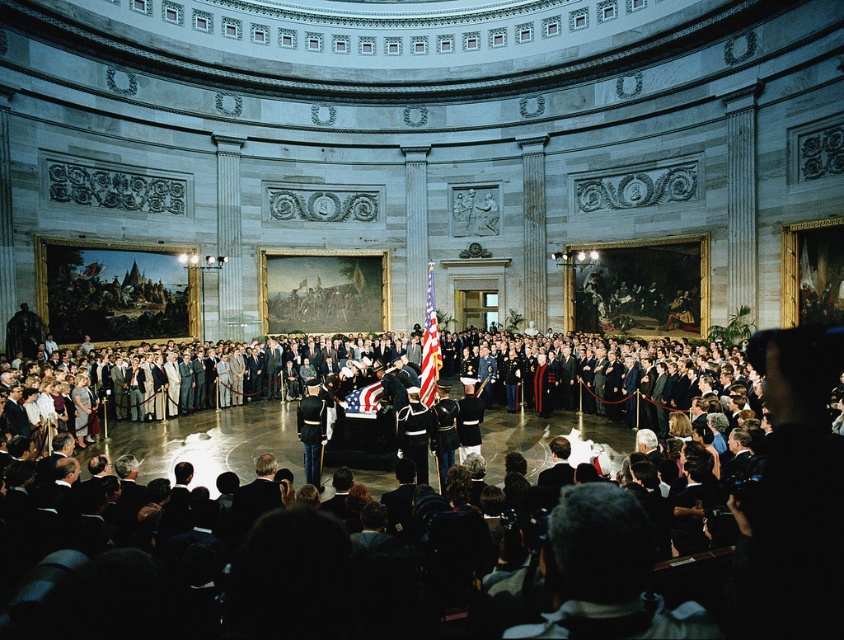
Does dark suit crowd at center have a lesser width compared to american flag at center?

In fact, dark suit crowd at center might be wider than american flag at center.

Does dark suit crowd at center appear on the left side of american flag at center?

Incorrect, dark suit crowd at center is not on the left side of american flag at center.

Is point (374, 612) positioned before point (371, 397)?

Yes, point (374, 612) is in front of point (371, 397).

You are a GUI agent. You are given a task and a screenshot of the screen. Output one action in this format:
    pyautogui.click(x=<x>, y=<y>)
    Task: Click on the dark suit crowd at center
    The image size is (844, 640).
    Given the screenshot: What is the action you would take?
    pyautogui.click(x=388, y=570)

Between point (607, 508) and point (426, 342), which one is positioned behind?

The point (426, 342) is more distant.

Between dark suit crowd at center and matte american flag at center, which one appears on the right side from the viewer's perspective?

dark suit crowd at center

The width and height of the screenshot is (844, 640). Find the location of `dark suit crowd at center`. dark suit crowd at center is located at coordinates (388, 570).

The image size is (844, 640). I want to click on dark suit crowd at center, so click(388, 570).

Looking at this image, can you confirm if matte american flag at center is positioned to the left of american flag at center?

Incorrect, matte american flag at center is not on the left side of american flag at center.

Can you confirm if matte american flag at center is shorter than american flag at center?

No, matte american flag at center is not shorter than american flag at center.

Is point (436, 323) farther from camera compared to point (376, 394)?

Yes, point (436, 323) is behind point (376, 394).

Identify the location of matte american flag at center. The image size is (844, 640). (429, 346).